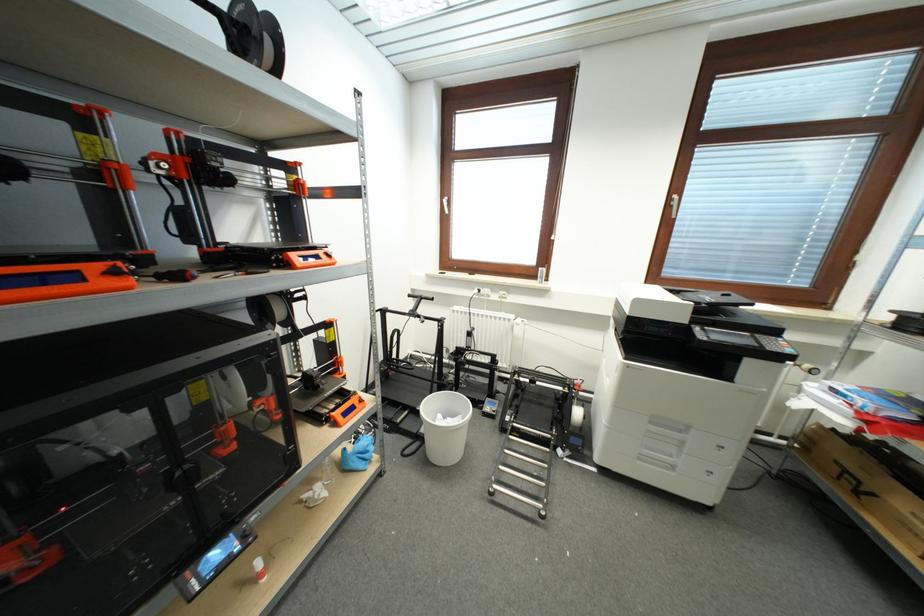
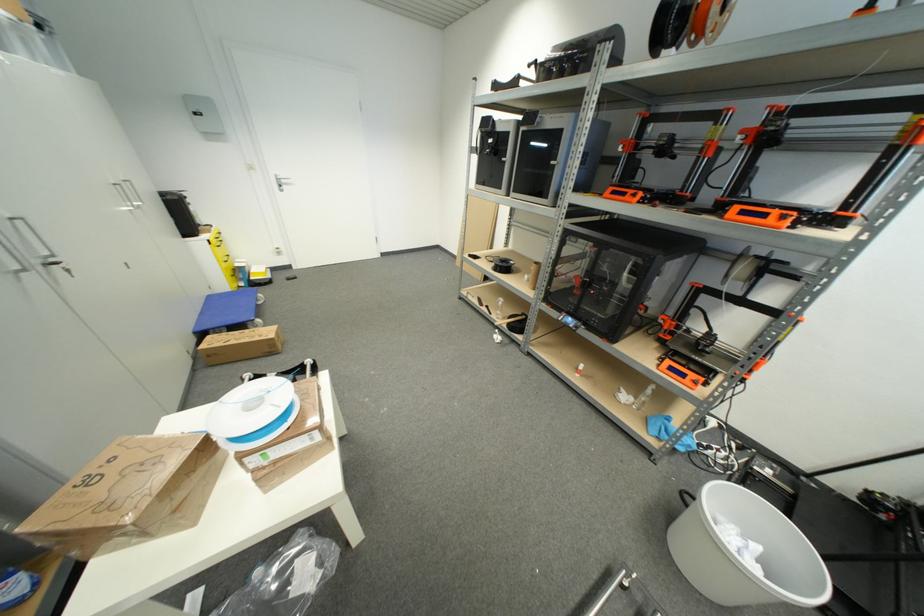
The point at [350,416] is marked in the first image. Where is the corresponding point in the second image?

(675, 371)